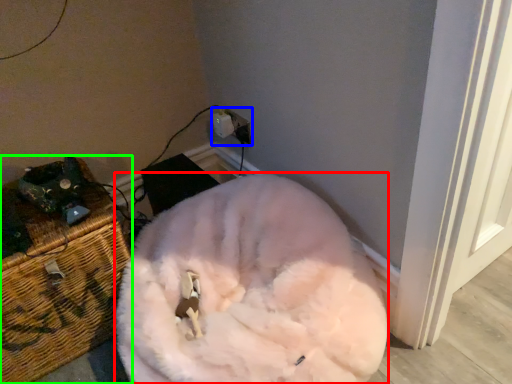
Question: Which object is positioned farthest from animal (highlighted by a red box)? Select from electric outlet (highlighted by a blue box) and furniture (highlighted by a green box).

Choices:
 (A) electric outlet
 (B) furniture

Answer: (A)